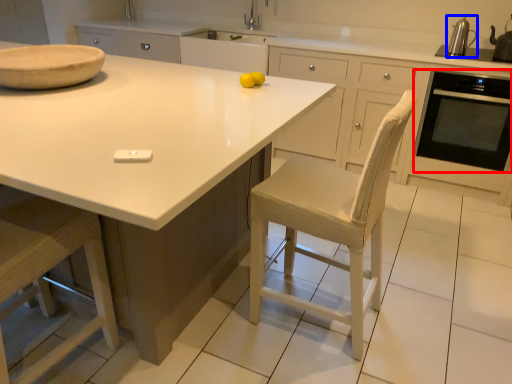
Question: Which object is further to the camera taking this photo, home appliance (highlighted by a red box) or kitchen appliance (highlighted by a blue box)?

Choices:
 (A) home appliance
 (B) kitchen appliance

Answer: (B)